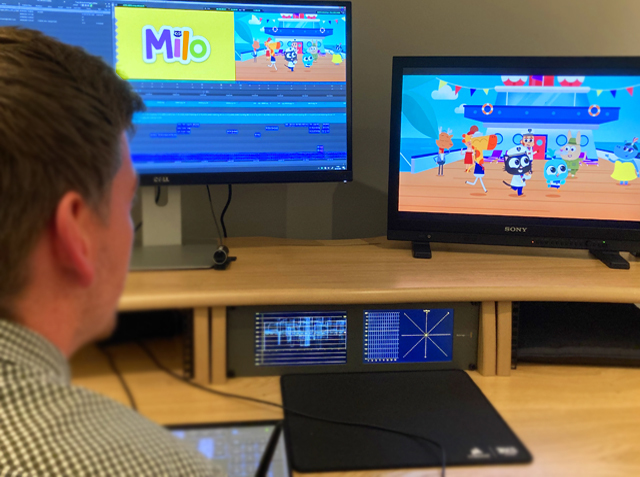
I want to click on mouse pad, so click(x=424, y=406).